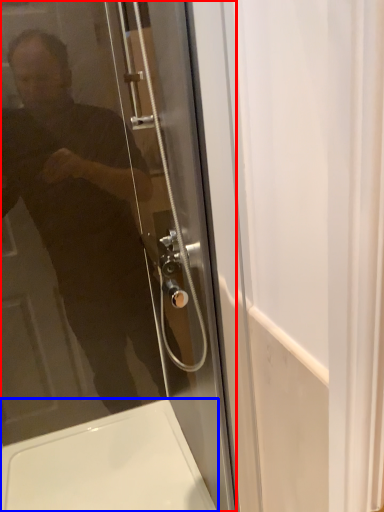
Question: Among these objects, which one is nearest to the camera, door (highlighted by a red box) or bath (highlighted by a blue box)?

Choices:
 (A) door
 (B) bath

Answer: (A)